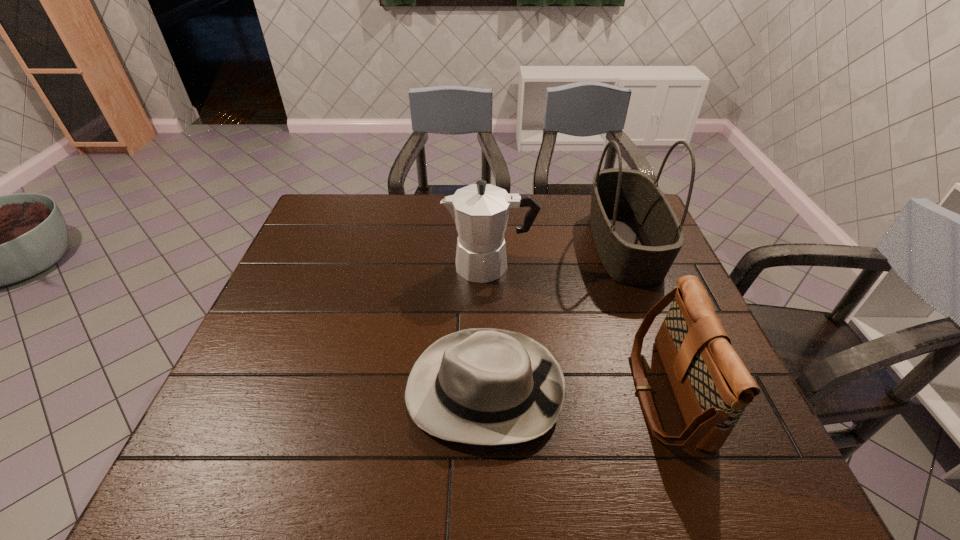
Locate an element on the screen. The height and width of the screenshot is (540, 960). vacant space located on the front-facing side of the shoulder bag is located at coordinates (559, 393).

Locate an element on the screen. The width and height of the screenshot is (960, 540). free spot located on the front-facing side of the shortest object is located at coordinates (243, 388).

I want to click on free space located on the front-facing side of the shortest object, so click(x=229, y=388).

I want to click on vacant area located 0.390m on the front-facing side of the shortest object, so click(229, 388).

The height and width of the screenshot is (540, 960). Find the location of `object present at the far edge`. object present at the far edge is located at coordinates (637, 235).

The width and height of the screenshot is (960, 540). What are the coordinates of `shoulder bag that is at the near edge` in the screenshot? It's located at (712, 386).

I want to click on fedora situated at the near edge, so click(x=481, y=386).

Find the location of a particular element. Image resolution: width=960 pixels, height=540 pixels. basket present at the right edge is located at coordinates (637, 235).

The image size is (960, 540). What are the coordinates of `shoulder bag present at the right edge` in the screenshot? It's located at (712, 386).

Identify the location of object positioned at the far right corner. (637, 235).